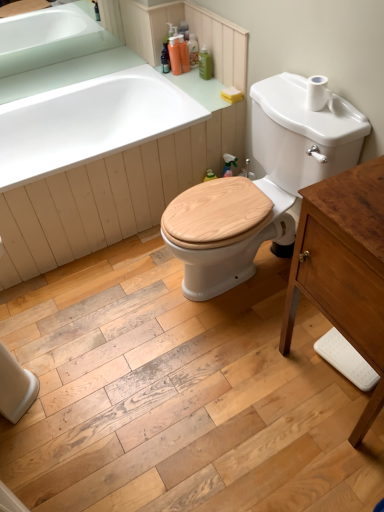
This screenshot has height=512, width=384. What do you see at coordinates (183, 54) in the screenshot? I see `translucent plastic soap dispenser at upper center, which appears as the 2th toiletry when viewed from the left` at bounding box center [183, 54].

Identify the location of white matte toilet paper at upper right. (318, 94).

Image resolution: width=384 pixels, height=512 pixels. What do you see at coordinates (193, 51) in the screenshot?
I see `translucent plastic soap at upper center, the 3th toiletry viewed from the left` at bounding box center [193, 51].

The width and height of the screenshot is (384, 512). What do you see at coordinates (344, 268) in the screenshot?
I see `wooden cabinet at right` at bounding box center [344, 268].

Locate an element on the screen. This screenshot has width=384, height=512. translucent plastic soap dispenser at upper center, marked as the 3th toiletry in a right-to-left arrangement is located at coordinates (183, 54).

From the image's perspective, does translucent plastic soap at upper center, which is the second toiletry from right to left, appear lower than orange plastic bottles at upper center, the fourth toiletry viewed from the right?

Actually, translucent plastic soap at upper center, which is the second toiletry from right to left, appears above orange plastic bottles at upper center, the fourth toiletry viewed from the right, in the image.

Which of these two, translucent plastic soap at upper center, the 3th toiletry viewed from the left, or orange plastic bottles at upper center, the fourth toiletry viewed from the right, is bigger?

With larger size is orange plastic bottles at upper center, the fourth toiletry viewed from the right.

Is translucent plastic soap at upper center, the 3th toiletry viewed from the left, directly adjacent to orange plastic bottles at upper center, the fourth toiletry viewed from the right?

Indeed, translucent plastic soap at upper center, the 3th toiletry viewed from the left, and orange plastic bottles at upper center, the fourth toiletry viewed from the right, are beside each other and touching.

Considering the sizes of orange plastic bottles at upper center, placed as the first toiletry when sorted from left to right, and green matte bottle at upper center, the 4th toiletry from the left, in the image, is orange plastic bottles at upper center, placed as the first toiletry when sorted from left to right, taller or shorter than green matte bottle at upper center, the 4th toiletry from the left,?

orange plastic bottles at upper center, placed as the first toiletry when sorted from left to right, is taller than green matte bottle at upper center, the 4th toiletry from the left.

From a real-world perspective, which is physically below, orange plastic bottles at upper center, the fourth toiletry viewed from the right, or green matte bottle at upper center, the first toiletry in the right-to-left sequence?

green matte bottle at upper center, the first toiletry in the right-to-left sequence.

Is orange plastic bottles at upper center, placed as the first toiletry when sorted from left to right, oriented away from green matte bottle at upper center, the first toiletry in the right-to-left sequence?

No.

From a real-world perspective, which is physically above, white matte toilet paper at upper right or translucent plastic soap dispenser at upper center, marked as the 3th toiletry in a right-to-left arrangement?

white matte toilet paper at upper right, from a real-world perspective.

You are a GUI agent. You are given a task and a screenshot of the screen. Output one action in this format:
    pyautogui.click(x=<x>, y=<y>)
    Task: Click on the 3rd toiletry counting from the left of the white matte toilet paper at upper right
    This screenshot has width=384, height=512.
    Given the screenshot: What is the action you would take?
    pyautogui.click(x=183, y=54)

Which of these two, white matte toilet paper at upper right or translucent plastic soap dispenser at upper center, which appears as the 2th toiletry when viewed from the left, is smaller?

translucent plastic soap dispenser at upper center, which appears as the 2th toiletry when viewed from the left.

Is white matte toilet paper at upper right far away from translucent plastic soap dispenser at upper center, which appears as the 2th toiletry when viewed from the left?

Yes.

Considering the relative sizes of translucent plastic soap at upper center, the 3th toiletry viewed from the left, and translucent plastic soap dispenser at upper center, which appears as the 2th toiletry when viewed from the left, in the image provided, is translucent plastic soap at upper center, the 3th toiletry viewed from the left, thinner than translucent plastic soap dispenser at upper center, which appears as the 2th toiletry when viewed from the left,?

Yes, translucent plastic soap at upper center, the 3th toiletry viewed from the left, is thinner than translucent plastic soap dispenser at upper center, which appears as the 2th toiletry when viewed from the left.

Is translucent plastic soap at upper center, the 3th toiletry viewed from the left, bigger than translucent plastic soap dispenser at upper center, marked as the 3th toiletry in a right-to-left arrangement?

Actually, translucent plastic soap at upper center, the 3th toiletry viewed from the left, might be smaller than translucent plastic soap dispenser at upper center, marked as the 3th toiletry in a right-to-left arrangement.

Can you confirm if translucent plastic soap at upper center, which is the second toiletry from right to left, is shorter than translucent plastic soap dispenser at upper center, marked as the 3th toiletry in a right-to-left arrangement?

No.

Does orange plastic bottles at upper center, placed as the first toiletry when sorted from left to right, have a greater width compared to white glossy sink at upper left?

Indeed, orange plastic bottles at upper center, placed as the first toiletry when sorted from left to right, has a greater width compared to white glossy sink at upper left.

Are orange plastic bottles at upper center, placed as the first toiletry when sorted from left to right, and white glossy sink at upper left making contact?

orange plastic bottles at upper center, placed as the first toiletry when sorted from left to right, and white glossy sink at upper left are not in contact.

Which object is positioned more to the left, orange plastic bottles at upper center, the fourth toiletry viewed from the right, or white glossy sink at upper left?

From the viewer's perspective, white glossy sink at upper left appears more on the left side.

From a real-world perspective, which object rests below the other?

orange plastic bottles at upper center, placed as the first toiletry when sorted from left to right, is physically lower.

Measure the distance from wooden cabinet at right to white matte toilet paper at upper right.

61.67 centimeters.

I want to click on toilet paper on the left of wooden cabinet at right, so click(x=318, y=94).

Considering the relative sizes of wooden cabinet at right and white matte toilet paper at upper right in the image provided, is wooden cabinet at right bigger than white matte toilet paper at upper right?

Yes.

Can you tell me how much wooden cabinet at right and white matte toilet paper at upper right differ in facing direction?

The angle between the facing direction of wooden cabinet at right and the facing direction of white matte toilet paper at upper right is 1.54 degrees.

Is wooden cabinet at right facing away from translucent plastic soap at upper center, which is the second toiletry from right to left?

wooden cabinet at right is not turned away from translucent plastic soap at upper center, which is the second toiletry from right to left.

Is point (354, 199) closer to camera compared to point (191, 46)?

Yes, it is.

Which of these two, wooden cabinet at right or translucent plastic soap at upper center, which is the second toiletry from right to left, is thinner?

translucent plastic soap at upper center, which is the second toiletry from right to left, is thinner.

Considering the relative positions of wooden cabinet at right and translucent plastic soap at upper center, which is the second toiletry from right to left, in the image provided, is wooden cabinet at right behind translucent plastic soap at upper center, which is the second toiletry from right to left,?

No.

This screenshot has height=512, width=384. In order to click on the 2nd toiletry in front of the translucent plastic soap at upper center, the 3th toiletry viewed from the left in this screenshot , I will do pyautogui.click(x=175, y=55).

From a real-world perspective, count 3rd toiletrys downward from the orange plastic bottles at upper center, placed as the first toiletry when sorted from left to right, and point to it. Please provide its 2D coordinates.

[(205, 63)]

Which object lies further to the anchor point white matte toilet paper at upper right, white glossy sink at upper left or wooden at center?

white glossy sink at upper left is further to white matte toilet paper at upper right.

Which object lies nearer to the anchor point white glossy sink at upper left, translucent plastic soap at upper center, the 3th toiletry viewed from the left, or translucent plastic soap dispenser at upper center, which appears as the 2th toiletry when viewed from the left?

Among the two, translucent plastic soap dispenser at upper center, which appears as the 2th toiletry when viewed from the left, is located nearer to white glossy sink at upper left.

Looking at the image, which one is located closer to green matte bottle at upper center, the first toiletry in the right-to-left sequence, translucent plastic soap dispenser at upper center, marked as the 3th toiletry in a right-to-left arrangement, or wooden cabinet at right?

Among the two, translucent plastic soap dispenser at upper center, marked as the 3th toiletry in a right-to-left arrangement, is located nearer to green matte bottle at upper center, the first toiletry in the right-to-left sequence.

Considering their positions, is translucent plastic soap dispenser at upper center, marked as the 3th toiletry in a right-to-left arrangement, positioned closer to white matte toilet paper at upper right than white glossy sink at upper left?

The object closer to white matte toilet paper at upper right is translucent plastic soap dispenser at upper center, marked as the 3th toiletry in a right-to-left arrangement.

Which object lies nearer to the anchor point white glossy sink at upper left, translucent plastic soap dispenser at upper center, which appears as the 2th toiletry when viewed from the left, or orange plastic bottles at upper center, the fourth toiletry viewed from the right?

orange plastic bottles at upper center, the fourth toiletry viewed from the right, is closer to white glossy sink at upper left.

Looking at the image, which one is located closer to white matte toilet paper at upper right, wooden at center or white glossy sink at upper left?

Based on the image, wooden at center appears to be nearer to white matte toilet paper at upper right.

Based on their spatial positions, is white matte toilet paper at upper right or wooden at center closer to translucent plastic soap dispenser at upper center, which appears as the 2th toiletry when viewed from the left?

The object closer to translucent plastic soap dispenser at upper center, which appears as the 2th toiletry when viewed from the left, is white matte toilet paper at upper right.

From the image, which object appears to be farther from wooden cabinet at right, green matte bottle at upper center, the 4th toiletry from the left, or orange plastic bottles at upper center, placed as the first toiletry when sorted from left to right?

Based on the image, orange plastic bottles at upper center, placed as the first toiletry when sorted from left to right, appears to be further to wooden cabinet at right.

Find the location of `toilet between wooden cabinet at right and green matte bottle at upper center, the first toiletry in the right-to-left sequence, in the front-back direction`. toilet between wooden cabinet at right and green matte bottle at upper center, the first toiletry in the right-to-left sequence, in the front-back direction is located at coordinates (260, 187).

Where is `toilet paper positioned between wooden at center and translucent plastic soap at upper center, the 3th toiletry viewed from the left, from near to far`? This screenshot has width=384, height=512. toilet paper positioned between wooden at center and translucent plastic soap at upper center, the 3th toiletry viewed from the left, from near to far is located at coordinates (318, 94).

The height and width of the screenshot is (512, 384). Find the location of `toilet paper positioned between wooden cabinet at right and green matte bottle at upper center, the first toiletry in the right-to-left sequence, from near to far`. toilet paper positioned between wooden cabinet at right and green matte bottle at upper center, the first toiletry in the right-to-left sequence, from near to far is located at coordinates (318, 94).

Find the location of a particular element. Image resolution: width=384 pixels, height=512 pixels. toilet between wooden cabinet at right and orange plastic bottles at upper center, the fourth toiletry viewed from the right, from front to back is located at coordinates (260, 187).